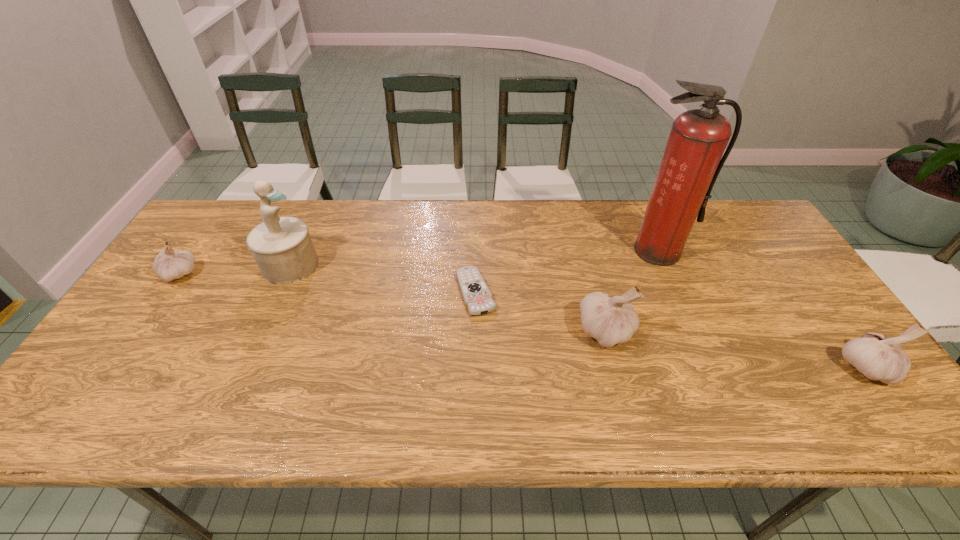
To ensure equal spacing by inserting another garlic among them, please point out a vacant spot for this new garlic. Please provide its 2D coordinates. Your answer should be formatted as a tuple, i.e. [(x, y)], where the tuple contains the x and y coordinates of a point satisfying the conditions above.

[(380, 301)]